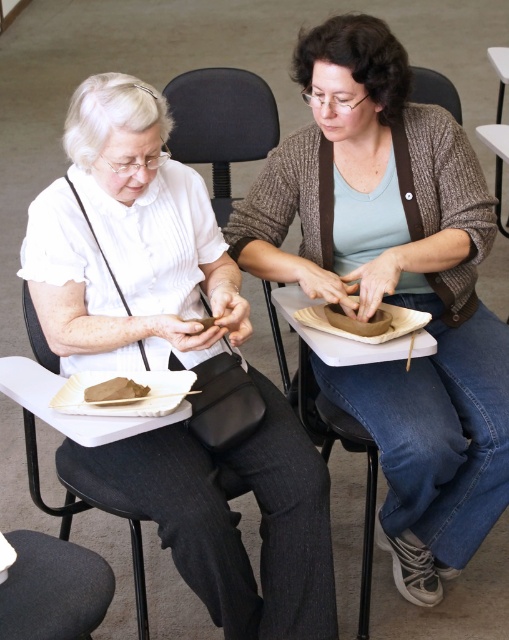
What are the coordinates of the matte brown clay pot at center?

The coordinates of the matte brown clay pot at center are at point (393, 285).

You are a pottery instructor observing the scene. You need to place a label next to the wider object between the matte brown clay pot at center and the brown paper bag at lower left. Which object should the label be placed next to?

The matte brown clay pot at center has a larger width than the brown paper bag at lower left, so the label should be placed next to the matte brown clay pot at center.

You are standing in front of the pottery classroom scene. There are two points marked in the image. The first point is at coordinate (433, 381) and the second point is at (498, 193). Which point is closer to you?

Point (433, 381) is closer to the viewer than point (498, 193).